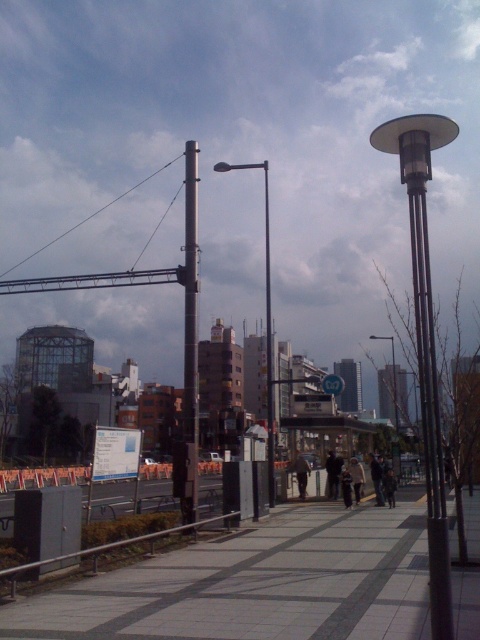
You are a delivery person who needs to pick up a package from the sidewalk. You see two jackets hanging on a lamppost on the right side of the frame. Which jacket is closer to the ground, the dark brown leather jacket at center or the light brown leather jacket at center?

The dark brown leather jacket at center is positioned under the light brown leather jacket at center, so the dark brown leather jacket at center is closer to the ground.

You are a delivery person needing to navigate between the metallic gray pole at center and the metallic pole at center. Which pole should you move towards if you want to go towards the right side of the street?

The metallic gray pole at center is positioned on the left side of metallic pole at center. Therefore, to go towards the right side of the street, you should move towards the metallic pole at center since it is located further to the right compared to the metallic gray pole at center.

From the picture: You are a delivery person who needs to place a small package on the sidewalk. The dark brown leather jacket at center and the light brown leather jacket at center are both on the sidewalk. Which jacket can you place the package next to without it overlapping?

The dark brown leather jacket at center has a smaller size compared to the light brown leather jacket at center, so placing the package next to the dark brown leather jacket at center would leave more space and prevent overlapping.